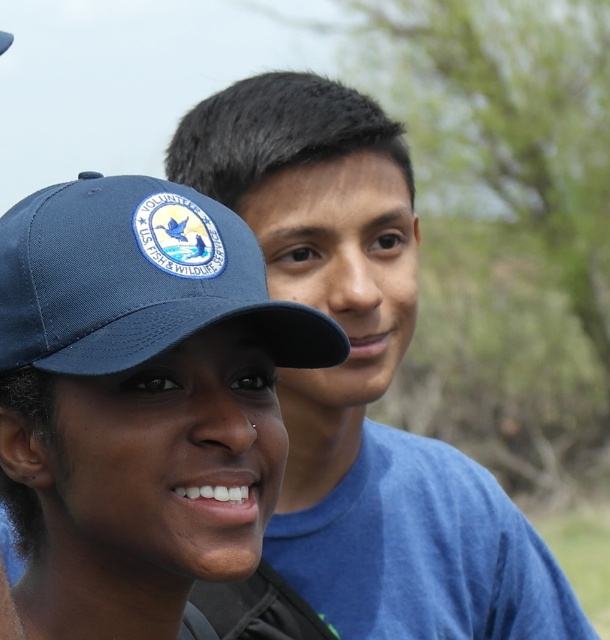
You are standing at the origin point of the image. You need to walk to the point labeled as point (314, 506). However, there is an obstacle located at point (46, 321). Will you encounter the obstacle before reaching your destination?

Yes, you will encounter the obstacle at point (46, 321) before reaching your destination at point (314, 506) because the obstacle is in front of the destination point according to the spatial arrangement.

You are a photographer trying to capture a group photo of the two volunteers. You need to arrange them so that the person wearing the matte blue shirt at upper right is to the right of the blue fabric baseball cap at upper left. Is this arrangement already correct based on their current positions?

Yes, the matte blue shirt at upper right is already positioned on the right side of the blue fabric baseball cap at upper left, so the arrangement is correct.

You are a photographer trying to capture a clear shot of both the blue fabric cap at center and the blue fabric baseball cap at upper left. Since you want to ensure both are visible in your photo, which cap should you focus on first to account for their sizes?

The blue fabric cap at center is taller than the blue fabric baseball cap at upper left, so you should focus on the blue fabric cap at center first because its greater height will make it more prominent in the frame, ensuring visibility alongside the smaller cap.